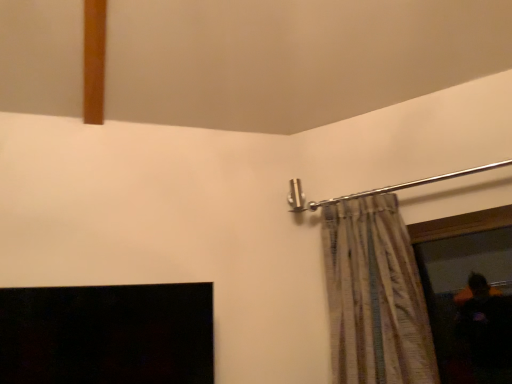
Question: In terms of width, does striped fabric curtain at upper right look wider or thinner when compared to clear glass window screen at right?

Choices:
 (A) wide
 (B) thin

Answer: (A)

Question: Considering the positions of striped fabric curtain at upper right and clear glass window screen at right in the image, is striped fabric curtain at upper right bigger or smaller than clear glass window screen at right?

Choices:
 (A) big
 (B) small

Answer: (A)

Question: Choose the correct answer: Is striped fabric curtain at upper right inside clear glass window screen at right or outside it?

Choices:
 (A) outside
 (B) inside

Answer: (A)

Question: Is clear glass window screen at right taller or shorter than striped fabric curtain at upper right?

Choices:
 (A) tall
 (B) short

Answer: (B)

Question: From a real-world perspective, relative to striped fabric curtain at upper right, is clear glass window screen at right vertically above or below?

Choices:
 (A) below
 (B) above

Answer: (A)

Question: From the image's perspective, is clear glass window screen at right positioned above or below striped fabric curtain at upper right?

Choices:
 (A) above
 (B) below

Answer: (B)

Question: Is clear glass window screen at right in front of or behind striped fabric curtain at upper right in the image?

Choices:
 (A) front
 (B) behind

Answer: (B)